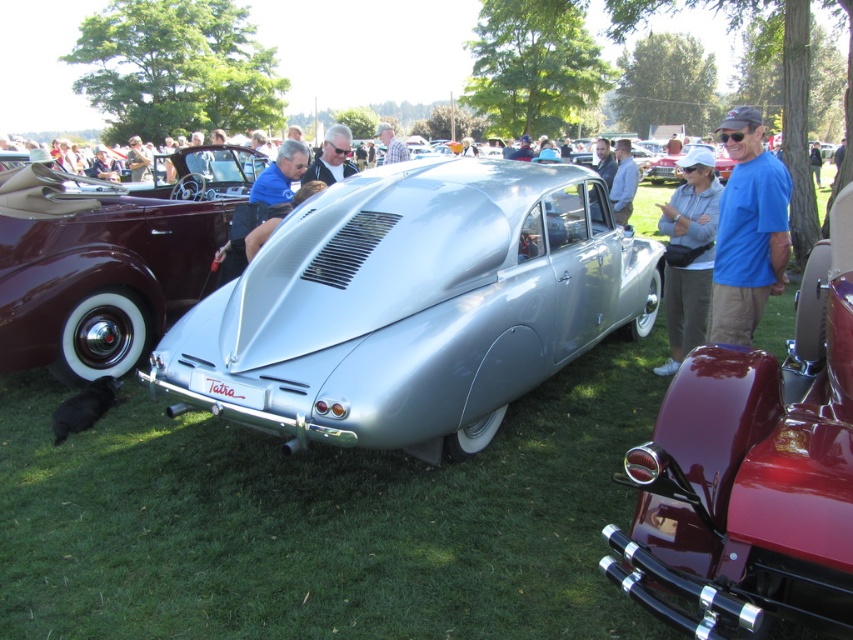
In the scene shown: You are a photographer at the car show and want to capture both the blue cotton shirt at right and the plaid shirt at center in your shot. Which shirt is positioned lower in the frame?

The blue cotton shirt at right is below the plaid shirt at center, so it is positioned lower in the frame.

You are at a car show and see a blue cotton shirt at right and a plaid shirt at center. Which shirt is located more to the right side of the scene?

The blue cotton shirt at right is more to the right than the plaid shirt at center.

You are a photographer at the car show and want to take a photo of the shiny maroon car at center and the blue fabric shirt at center. Based on their positions, which object is closer to the camera?

The shiny maroon car at center is closer to the camera than the blue fabric shirt at center because it is in front of it.